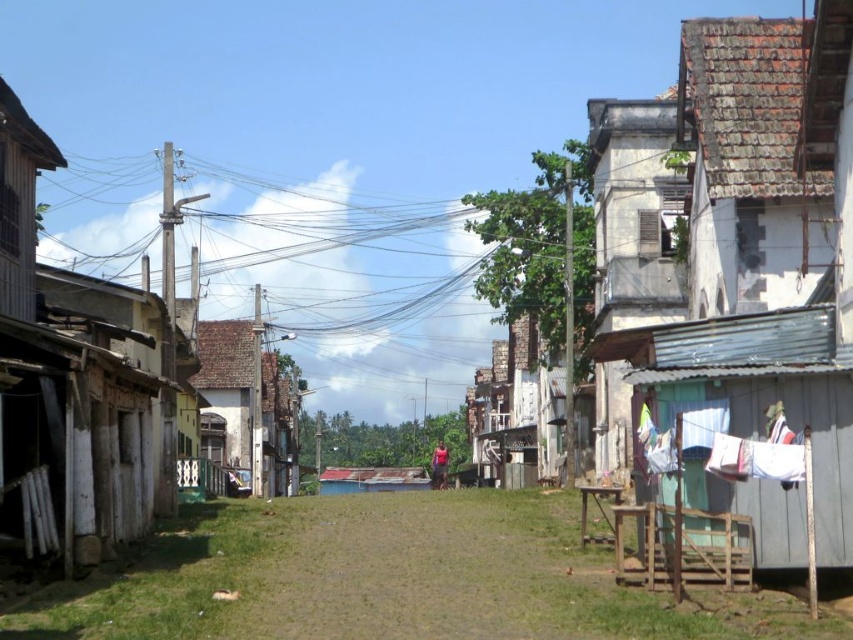
Question: Can you confirm if wooden hut at left is positioned above white wooden hut at center?

Choices:
 (A) no
 (B) yes

Answer: (B)

Question: Which object is positioned farthest from the white wooden hut at center?

Choices:
 (A) rusty corrugated metal hut at right
 (B) white fabric at right
 (C) wooden hut at left

Answer: (B)

Question: Does rusty corrugated metal hut at right have a smaller size compared to white fabric at right?

Choices:
 (A) yes
 (B) no

Answer: (B)

Question: Estimate the real-world distances between objects in this image. Which object is closer to the wooden hut at left?

Choices:
 (A) white fabric at right
 (B) white wooden hut at center
 (C) brown tile roof hut at center
 (D) rusty corrugated metal hut at right

Answer: (A)

Question: Which of the following is the closest to the observer?

Choices:
 (A) (676, 452)
 (B) (825, 70)
 (C) (231, 460)

Answer: (A)

Question: Is wooden hut at left smaller than white wooden hut at center?

Choices:
 (A) yes
 (B) no

Answer: (A)